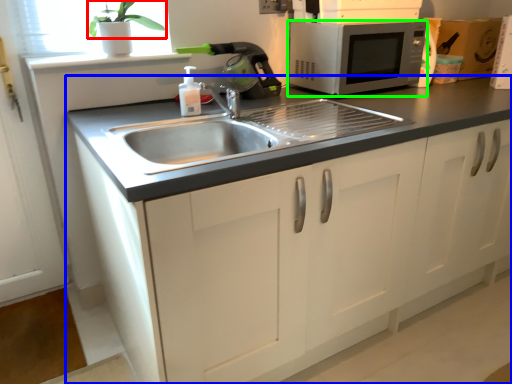
Question: Considering the real-world distances, which object is closest to plant (highlighted by a red box)? cabinetry (highlighted by a blue box) or microwave oven (highlighted by a green box).

Choices:
 (A) cabinetry
 (B) microwave oven

Answer: (B)